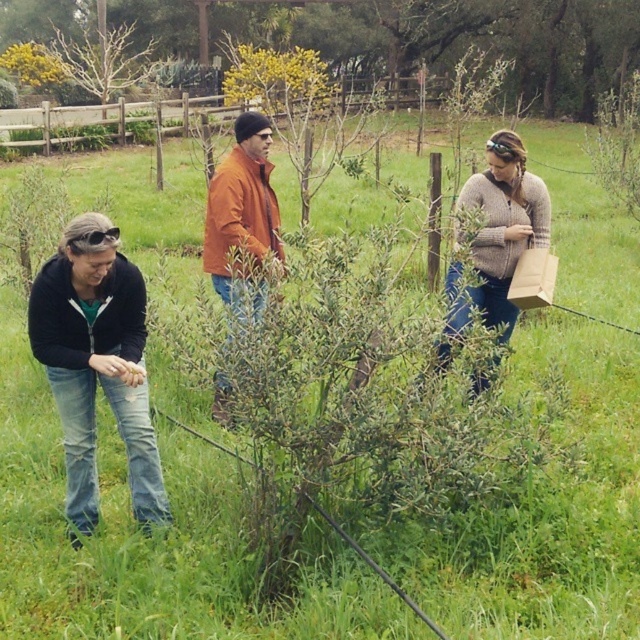
Can you confirm if green leafy bush at center is positioned to the left of knitted sweater at center?

Yes, green leafy bush at center is to the left of knitted sweater at center.

Does point (64, 6) lie behind point (541, 182)?

Yes, it is.

Who is more forward, (541, 10) or (472, 208)?

Positioned in front is point (472, 208).

Image resolution: width=640 pixels, height=640 pixels. I want to click on green leafy bush at center, so click(x=458, y=38).

Which is above, knitted sweater at center or matte black goggles at lower left?

matte black goggles at lower left

How distant is knitted sweater at center from matte black goggles at lower left?

knitted sweater at center is 2.12 meters away from matte black goggles at lower left.

At what (x,y) coordinates should I click in order to perform the action: click on knitted sweater at center. Please return your answer as a coordinate pair (x, y). The height and width of the screenshot is (640, 640). Looking at the image, I should click on (502, 225).

Does point (128, 417) come in front of point (481, 177)?

Yes, it is in front of point (481, 177).

Find the location of a particular element. denim jeans at lower left is located at coordinates (97, 369).